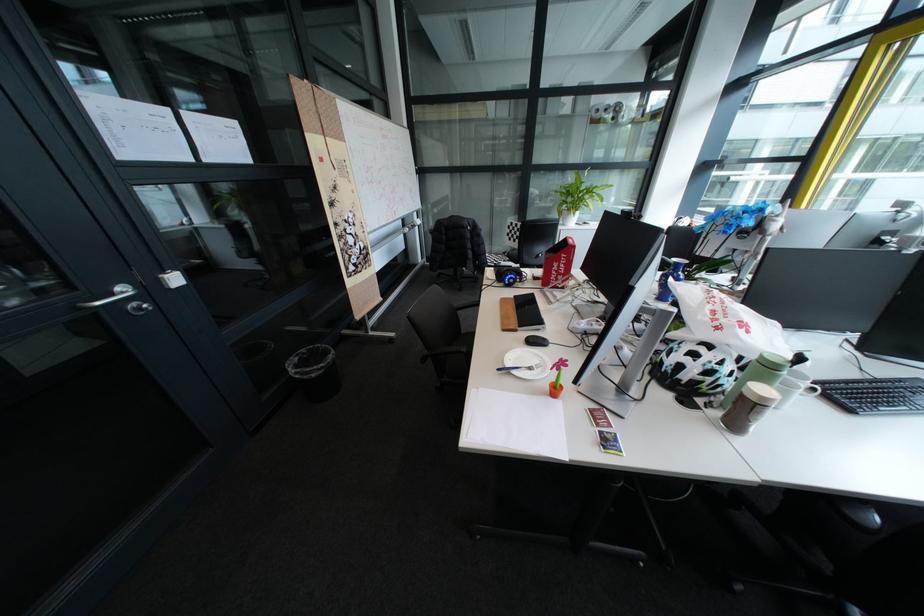
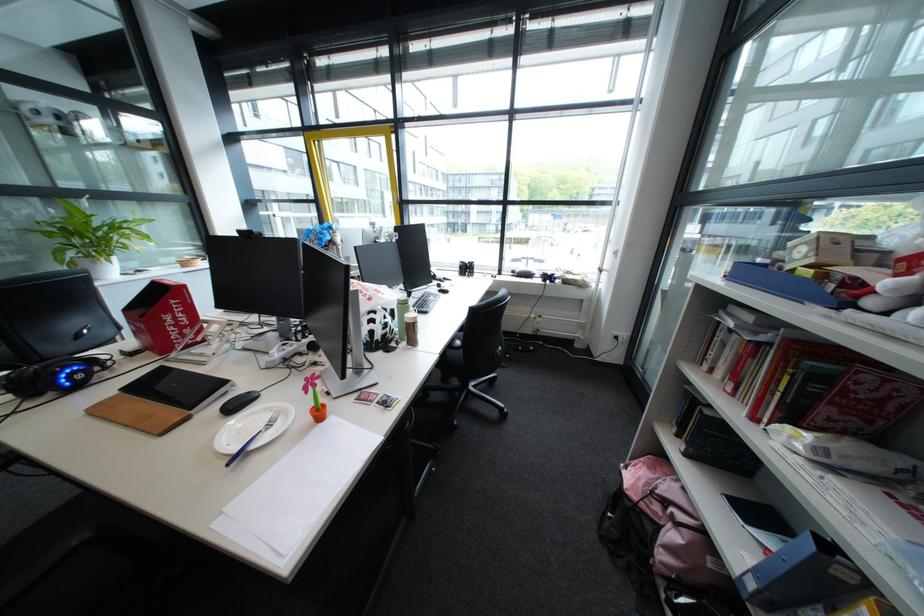
Question: The camera is either moving clockwise (left) or counter-clockwise (right) around the object. The first image is from the beginning of the video and the second image is from the end. Is the camera moving left or right when shooting the video?

Choices:
 (A) Left
 (B) Right

Answer: (A)